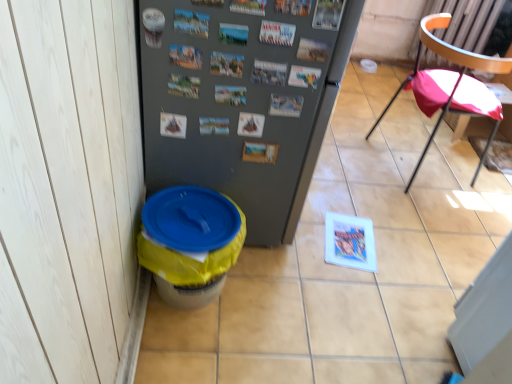
This screenshot has width=512, height=384. What are the coordinates of `vacant space in between gray matte refrigerator at center and pink fabric chair at right` in the screenshot? It's located at (359, 195).